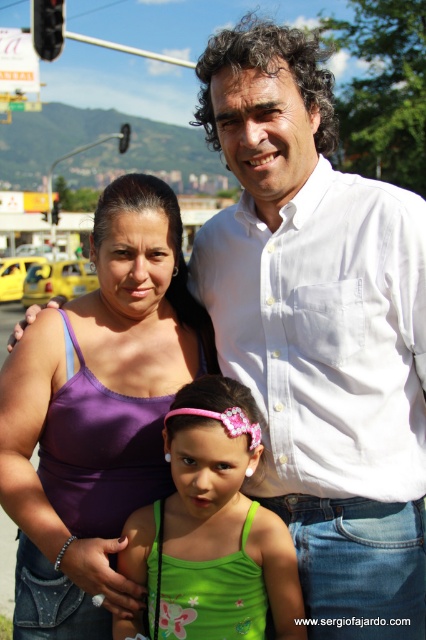
Is point (75, 614) farther from camera compared to point (227, 577)?

That is True.

Who is higher up, purple fabric tank top at center or green fabric dress at center?

purple fabric tank top at center is above.

Is point (97, 376) positioned in front of point (218, 509)?

No.

This screenshot has height=640, width=426. Identify the location of purple fabric tank top at center. (97, 413).